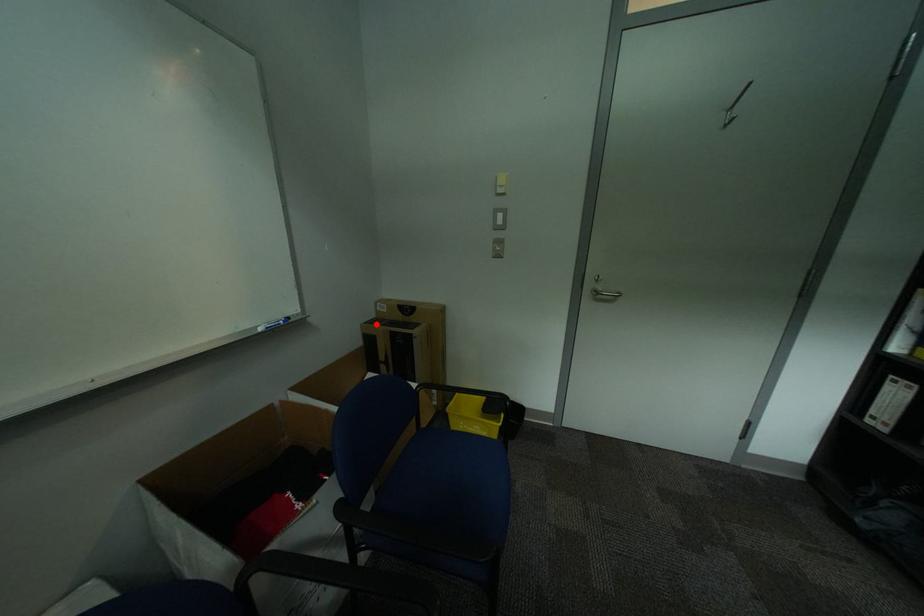
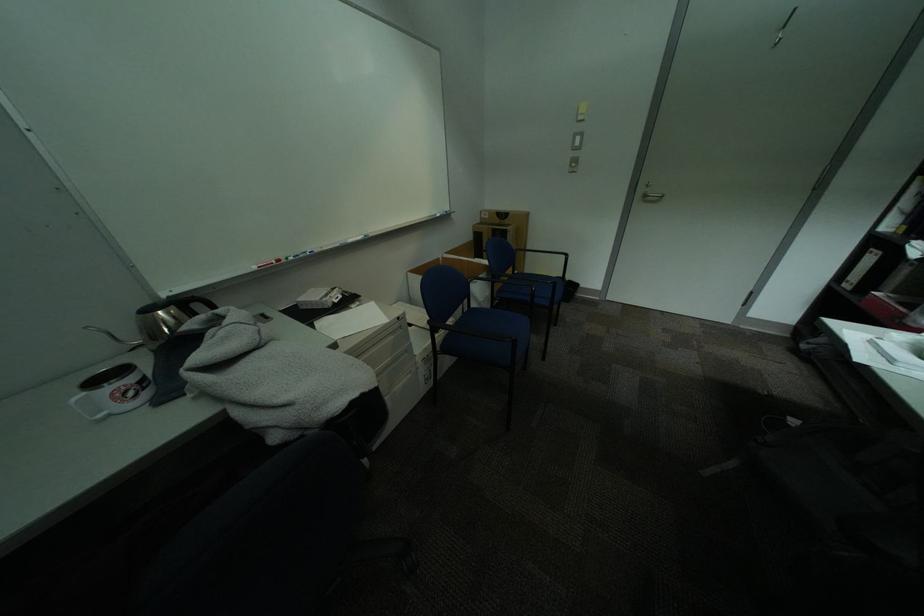
The point at the highlighted location is marked in the first image. Where is the corresponding point in the second image?

(487, 225)